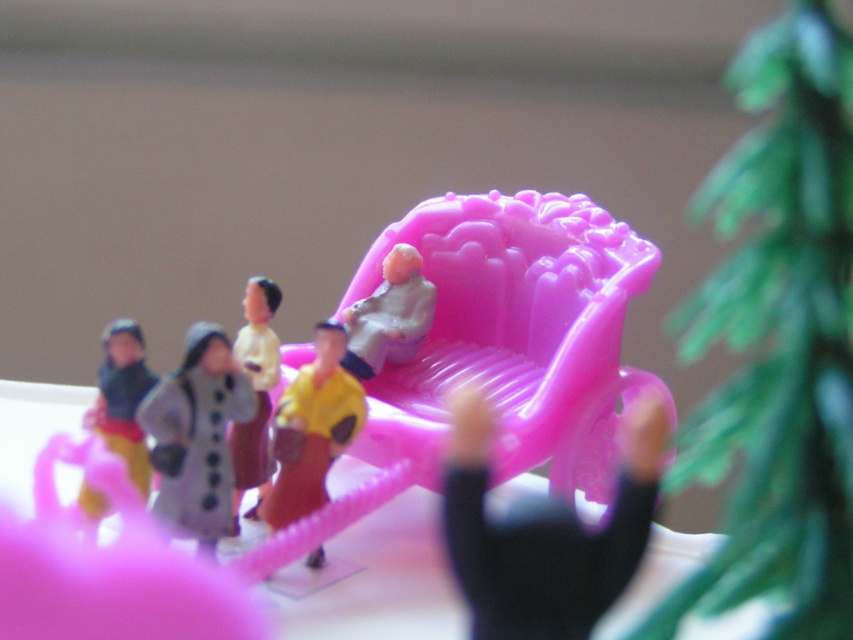
Which is below, black matte figure at center or yellow matte toy at center?

yellow matte toy at center is below.

Can you confirm if black matte figure at center is thinner than yellow matte toy at center?

No, black matte figure at center is not thinner than yellow matte toy at center.

Measure the distance between black matte figure at center and camera.

black matte figure at center and camera are 51.96 centimeters apart from each other.

Find the location of a particular element. The height and width of the screenshot is (640, 853). black matte figure at center is located at coordinates point(544,531).

Which is below, pink plastic armchair at center or yellow matte toy at center?

yellow matte toy at center

How distant is pink plastic armchair at center from yellow matte toy at center?

6.51 inches

You are a GUI agent. You are given a task and a screenshot of the screen. Output one action in this format:
    pyautogui.click(x=<x>, y=<y>)
    Task: Click on the pink plastic armchair at center
    The height and width of the screenshot is (640, 853).
    Given the screenshot: What is the action you would take?
    pyautogui.click(x=514, y=333)

This screenshot has height=640, width=853. Find the location of `pink plastic armchair at center`. pink plastic armchair at center is located at coordinates (514, 333).

From the picture: Who is shorter, gray matte coat at center or matte white figure at center?

Standing shorter between the two is matte white figure at center.

Looking at this image, which is more to the left, gray matte coat at center or matte white figure at center?

gray matte coat at center is more to the left.

Who is more forward, [192,328] or [401,344]?

Point [192,328]

The height and width of the screenshot is (640, 853). Find the location of `gray matte coat at center`. gray matte coat at center is located at coordinates (196, 436).